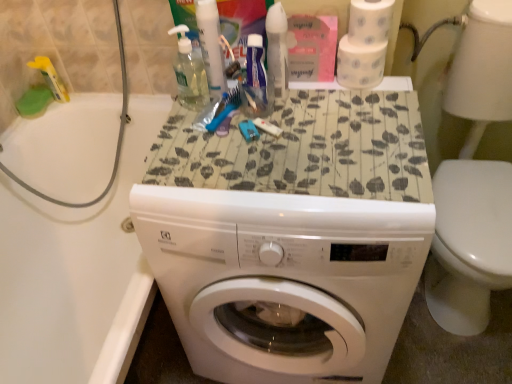
Question: Is white textured toilet paper at upper right, which is counted as the 1th toilet paper, starting from the top, to the left of yellow plastic bottle at upper left, which ranks as the second toiletry in front-to-back order, from the viewer's perspective?

Choices:
 (A) no
 (B) yes

Answer: (A)

Question: Could you tell me if white textured toilet paper at upper right, the 2th toilet paper when ordered from bottom to top, is facing yellow plastic bottle at upper left, which ranks as the second toiletry in front-to-back order?

Choices:
 (A) no
 (B) yes

Answer: (A)

Question: Considering the relative positions of white textured toilet paper at upper right, the 2th toilet paper when ordered from bottom to top, and yellow plastic bottle at upper left, which ranks as the second toiletry in front-to-back order, in the image provided, is white textured toilet paper at upper right, the 2th toilet paper when ordered from bottom to top, to the right of yellow plastic bottle at upper left, which ranks as the second toiletry in front-to-back order, from the viewer's perspective?

Choices:
 (A) no
 (B) yes

Answer: (B)

Question: Is white textured toilet paper at upper right, the 2th toilet paper when ordered from bottom to top, thinner than yellow plastic bottle at upper left, which is counted as the 1th toiletry, starting from the left?

Choices:
 (A) no
 (B) yes

Answer: (A)

Question: Would you consider white textured toilet paper at upper right, which is counted as the 1th toilet paper, starting from the top, to be distant from yellow plastic bottle at upper left, which ranks as the second toiletry in front-to-back order?

Choices:
 (A) no
 (B) yes

Answer: (B)

Question: Is white textured toilet paper at upper right, which is counted as the 1th toilet paper, starting from the top, taller than yellow plastic bottle at upper left, which ranks as the second toiletry in front-to-back order?

Choices:
 (A) no
 (B) yes

Answer: (A)

Question: Does white textured toilet paper at upper right, the 2th toilet paper when ordered from top to bottom, come behind transparent liquid soap at upper center, the 1th cleaning product when ordered from left to right?

Choices:
 (A) yes
 (B) no

Answer: (A)

Question: Can you confirm if white textured toilet paper at upper right, which is the first toilet paper from bottom to top, is shorter than transparent liquid soap at upper center, the 1th cleaning product when ordered from left to right?

Choices:
 (A) no
 (B) yes

Answer: (B)

Question: Is white textured toilet paper at upper right, the 2th toilet paper when ordered from top to bottom, far from transparent liquid soap at upper center, the second cleaning product in the right-to-left sequence?

Choices:
 (A) no
 (B) yes

Answer: (A)

Question: From a real-world perspective, does white textured toilet paper at upper right, the 2th toilet paper when ordered from top to bottom, sit lower than transparent liquid soap at upper center, the second cleaning product in the right-to-left sequence?

Choices:
 (A) yes
 (B) no

Answer: (A)

Question: Is white textured toilet paper at upper right, which is the first toilet paper from bottom to top, taller than transparent liquid soap at upper center, the 1th cleaning product when ordered from left to right?

Choices:
 (A) yes
 (B) no

Answer: (B)

Question: Are white textured toilet paper at upper right, which is the first toilet paper from bottom to top, and transparent liquid soap at upper center, the 1th cleaning product when ordered from left to right, beside each other?

Choices:
 (A) no
 (B) yes

Answer: (A)

Question: From a real-world perspective, does white glossy washer at lower right sit lower than white glossy bathtub at left?

Choices:
 (A) yes
 (B) no

Answer: (B)